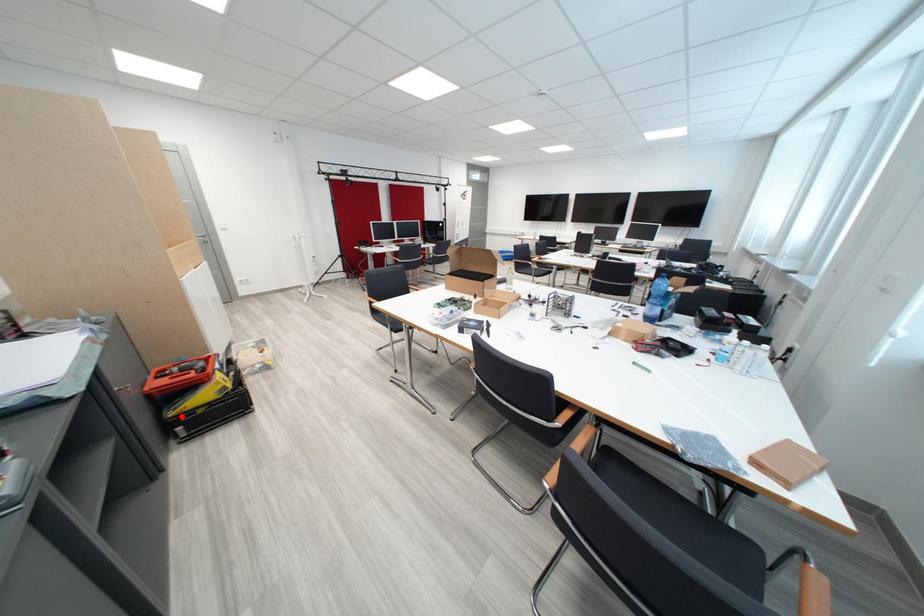
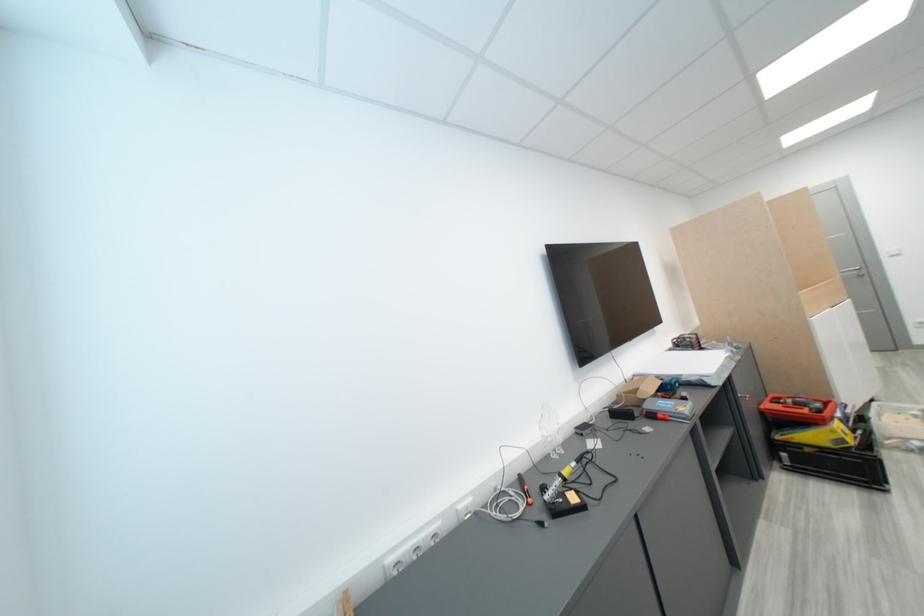
Find the pixel in the second image that matches the highlighted location in the first image.

(788, 439)